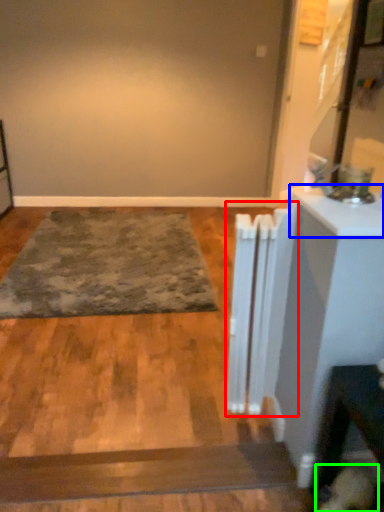
Question: Based on their relative distances, which object is nearer to radiator (highlighted by a red box)? Choose from counter top (highlighted by a blue box) and dog (highlighted by a green box).

Choices:
 (A) counter top
 (B) dog

Answer: (A)